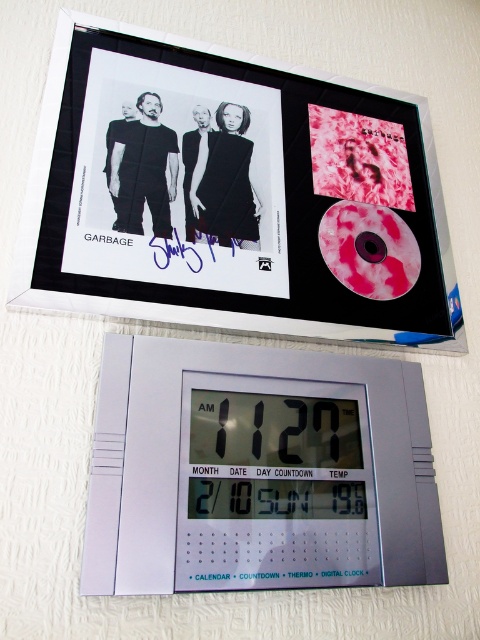
You are an interior designer arranging items on a wall. You have a matte black album cover at upper center and a silver plastic digital clock at upper center. Which item is located to the left of the other?

The matte black album cover at upper center is positioned on the left side of silver plastic digital clock at upper center.

You are an art installer who needs to hang a new poster exactly 30 inches from the viewer. The matte black album cover at upper center is already mounted on the wall. Can you use it as a reference point to determine where to place your new poster?

The matte black album cover at upper center is 29.70 inches from the viewer, so it is very close to the desired 30 inches. You can use it as a reference point by placing your new poster slightly further away from the viewer to reach the exact 30 inches distance.